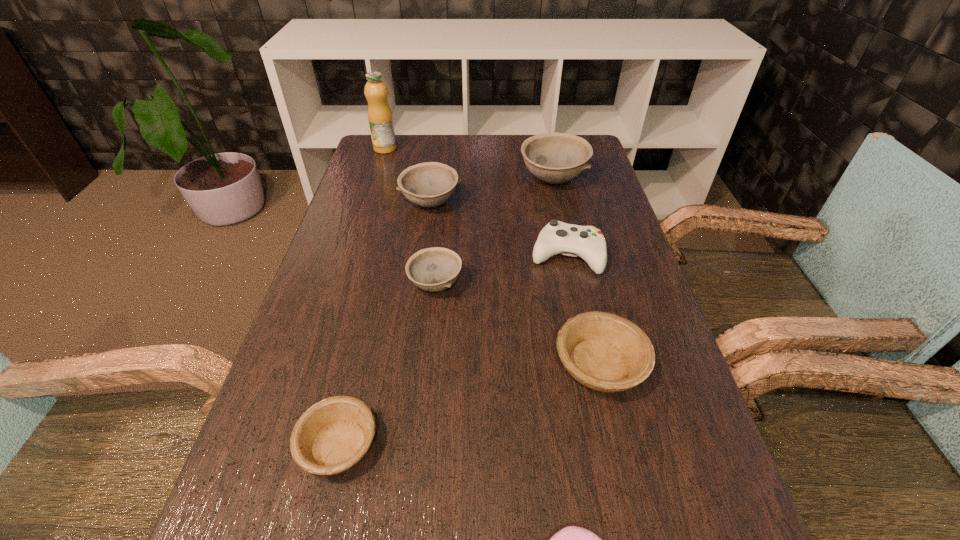
The width and height of the screenshot is (960, 540). Find the location of `the sixth farthest object`. the sixth farthest object is located at coordinates (606, 352).

Locate an element on the screen. Image resolution: width=960 pixels, height=540 pixels. the second nearest object is located at coordinates (333, 435).

Where is `the smaller beige bowl`? the smaller beige bowl is located at coordinates (333, 435).

Where is `free spot located 0.260m on the front label of the fruit juice`? This screenshot has height=540, width=960. free spot located 0.260m on the front label of the fruit juice is located at coordinates (370, 199).

Where is `vacant space located on the left of the biggest gray bowl`? This screenshot has height=540, width=960. vacant space located on the left of the biggest gray bowl is located at coordinates (x=395, y=179).

Locate an element on the screen. This screenshot has height=540, width=960. free space located on the front of the third tallest object is located at coordinates (413, 334).

Where is `vacant position located on the back of the white control`? The height and width of the screenshot is (540, 960). vacant position located on the back of the white control is located at coordinates (555, 201).

You are a GUI agent. You are given a task and a screenshot of the screen. Output one action in this format:
    pyautogui.click(x=<x>, y=<y>)
    Task: Click on the vacant area situated 0.390m on the back of the third farthest bowl
    The image size is (960, 540).
    Given the screenshot: What is the action you would take?
    pyautogui.click(x=446, y=180)

I want to click on blank space located 0.060m on the left of the second nearest bowl, so click(522, 365).

Locate an element on the screen. The width and height of the screenshot is (960, 540). free space located on the back of the nearer beige bowl is located at coordinates (372, 306).